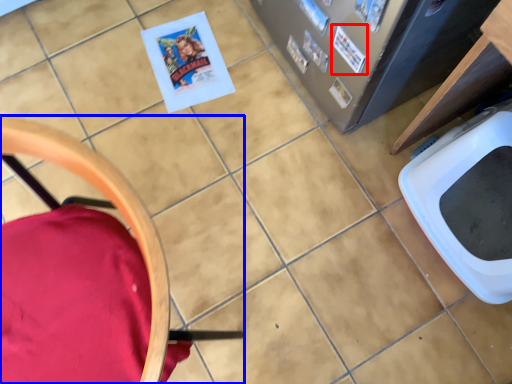
Question: Which of the following is the farthest to the observer, comic book (highlighted by a red box) or chair (highlighted by a blue box)?

Choices:
 (A) comic book
 (B) chair

Answer: (A)